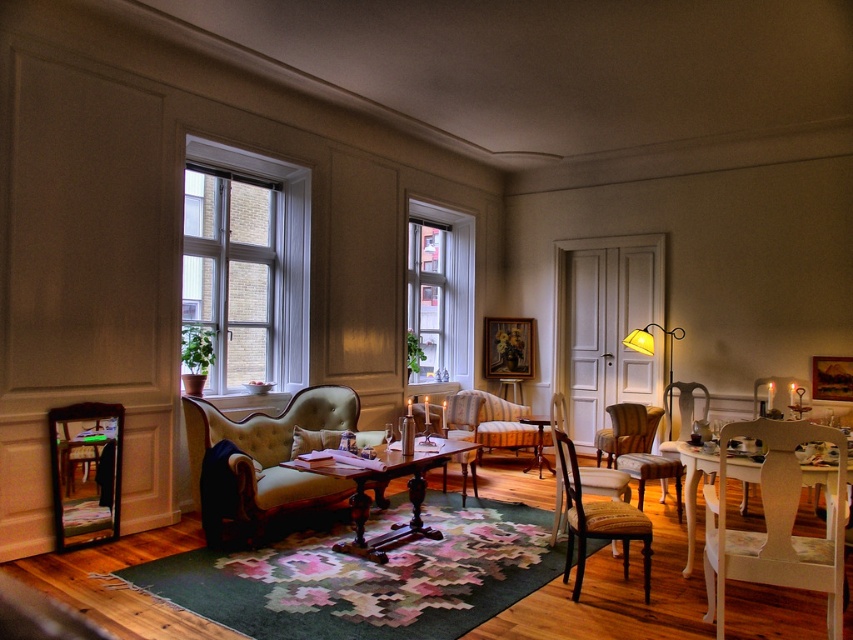
Question: Which object appears farthest from the camera in this image?

Choices:
 (A) white wooden window at left
 (B) woven fabric chair at center
 (C) matte gold lamp at center-right

Answer: (C)

Question: Which object is the closest to the woven fabric chair at center?

Choices:
 (A) white wood window at center
 (B) matte gold lamp at center-right

Answer: (B)

Question: Is tufted leather couch at center below velvet green armchair at center?

Choices:
 (A) no
 (B) yes

Answer: (A)

Question: Does white wooden window at left appear over matte gold lamp at center-right?

Choices:
 (A) yes
 (B) no

Answer: (A)

Question: Is wooden chair at center closer to the viewer compared to matte gold lamp at center-right?

Choices:
 (A) yes
 (B) no

Answer: (A)

Question: Which of these objects is positioned farthest from the white wooden window at left?

Choices:
 (A) velvet green armchair at center
 (B) white wood window at center

Answer: (A)